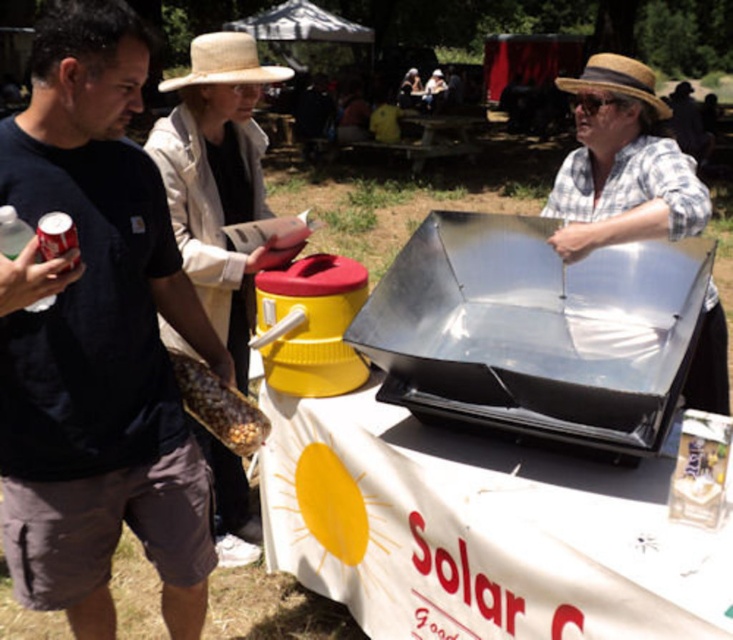
Consider the image. Can you confirm if straw hat at upper center is taller than straw hat at center?

In fact, straw hat at upper center may be shorter than straw hat at center.

Between point (235, 80) and point (608, 56), which one is positioned in front?

Point (608, 56)

The height and width of the screenshot is (640, 733). What are the coordinates of `straw hat at upper center` in the screenshot? It's located at (224, 61).

Is dark blue t-shirt at left to the left of straw hat at center from the viewer's perspective?

Yes, dark blue t-shirt at left is to the left of straw hat at center.

Can you confirm if dark blue t-shirt at left is shorter than straw hat at center?

Indeed, dark blue t-shirt at left has a lesser height compared to straw hat at center.

Find the location of `dark blue t-shirt at left`. dark blue t-shirt at left is located at coordinates click(x=97, y=340).

Is brown textured corn at lower left above straw hat at center?

No, brown textured corn at lower left is not above straw hat at center.

Is point (194, 371) in front of point (596, 88)?

Yes, it is.

Identify the location of brown textured corn at lower left. Image resolution: width=733 pixels, height=640 pixels. (218, 404).